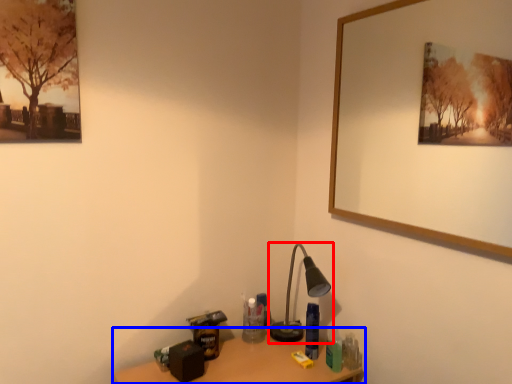
Question: Which of the following is the farthest to the observer, lamp (highlighted by a red box) or table (highlighted by a blue box)?

Choices:
 (A) lamp
 (B) table

Answer: (A)